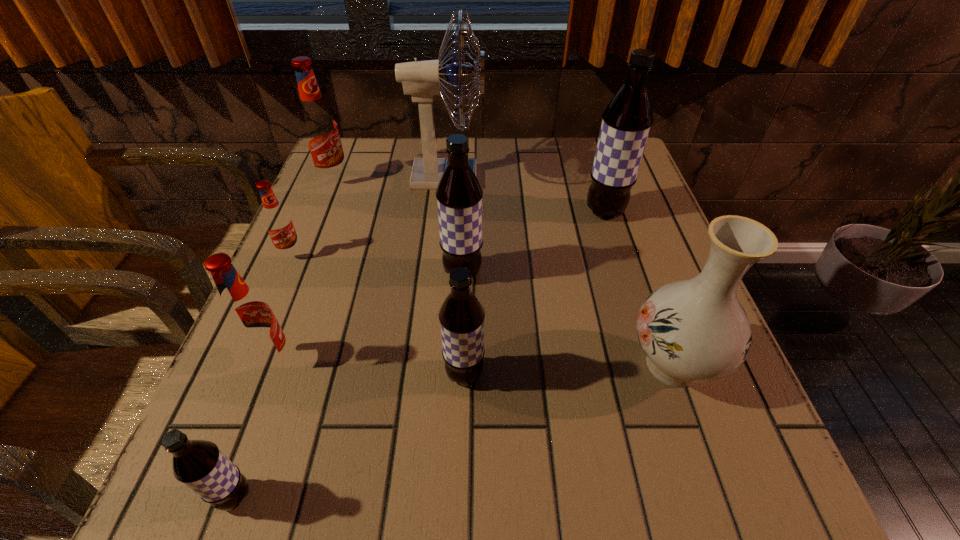
Identify the location of object that can be found as the third closest to the smallest red root beer. The image size is (960, 540). (422, 80).

Identify which object is the closest to the fan. Please provide its 2D coordinates. Your answer should be formatted as a tuple, i.e. [(x, y)], where the tuple contains the x and y coordinates of a point satisfying the conditions above.

[(319, 128)]

The width and height of the screenshot is (960, 540). Find the location of `root beer that is the second closest to the farthest red root beer`. root beer that is the second closest to the farthest red root beer is located at coordinates (459, 194).

Locate which root beer ranks in proximity to the biggest red root beer. Please provide its 2D coordinates. Your answer should be formatted as a tuple, i.e. [(x, y)], where the tuple contains the x and y coordinates of a point satisfying the conditions above.

[(278, 222)]

I want to click on brown root beer that stands as the closest to the farthest brown root beer, so click(459, 194).

Where is `brown root beer that is the fourth closest to the vase`? brown root beer that is the fourth closest to the vase is located at coordinates (199, 464).

The width and height of the screenshot is (960, 540). What are the coordinates of `the closest red root beer relative to the nearest red root beer` in the screenshot? It's located at (278, 222).

Select which red root beer appears as the closest to the leftmost brown root beer. Please provide its 2D coordinates. Your answer should be formatted as a tuple, i.e. [(x, y)], where the tuple contains the x and y coordinates of a point satisfying the conditions above.

[(249, 318)]

Identify the location of free space that satisfies the following two spatial constraints: 1. on the front-facing side of the biggest brown root beer; 2. on the right side of the fan. This screenshot has height=540, width=960. (444, 212).

Locate an element on the screen. vacant point that satisfies the following two spatial constraints: 1. on the front side of the farthest root beer; 2. on the right side of the vase is located at coordinates (258, 364).